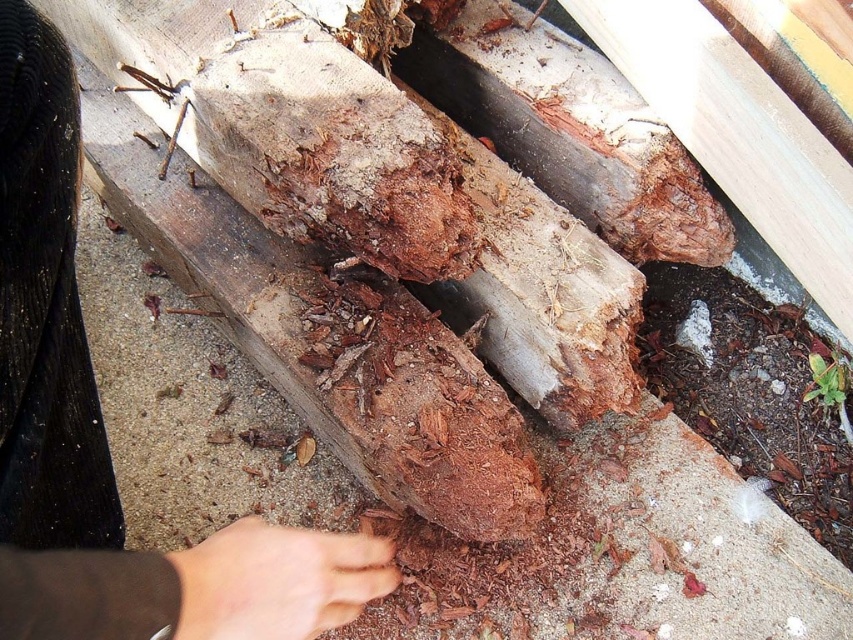
Question: Considering the real-world distances, which object is closest to the dry skin at lower center?

Choices:
 (A) brown leather hand at lower center
 (B) rusty wood plank at center

Answer: (A)

Question: Estimate the real-world distances between objects in this image. Which object is closer to the brown leather hand at lower center?

Choices:
 (A) dry skin at lower center
 (B) rusty wood plank at center

Answer: (A)

Question: Is the position of brown leather hand at lower center less distant than that of rusty wood plank at center?

Choices:
 (A) no
 (B) yes

Answer: (B)

Question: Which is farther from the rusty wood plank at center?

Choices:
 (A) brown leather hand at lower center
 (B) dry skin at lower center

Answer: (A)

Question: Can you confirm if rusty wood plank at center is thinner than dry skin at lower center?

Choices:
 (A) no
 (B) yes

Answer: (A)

Question: Does brown leather hand at lower center have a smaller size compared to rusty wood plank at center?

Choices:
 (A) yes
 (B) no

Answer: (B)